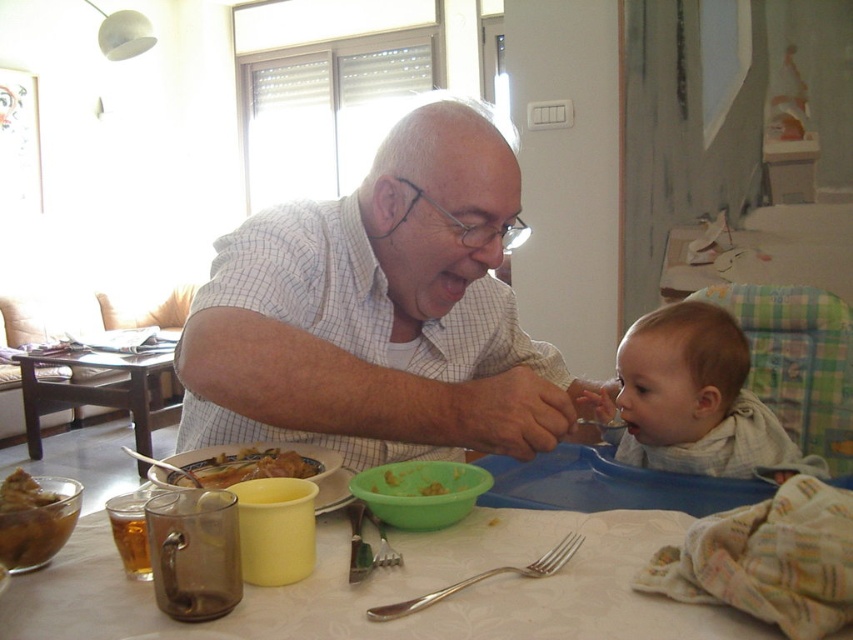
Is wooden table at center to the left of satin silver fork at table center from the viewer's perspective?

Indeed, wooden table at center is positioned on the left side of satin silver fork at table center.

Is wooden table at center to the right of satin silver fork at table center from the viewer's perspective?

In fact, wooden table at center is to the left of satin silver fork at table center.

Is point (22, 365) farther from camera compared to point (375, 609)?

Yes, it is behind point (375, 609).

What are the coordinates of `wooden table at center` in the screenshot? It's located at (97, 392).

From the picture: Is white textured tablecloth at center smaller than golden brown bread at center?

Incorrect, white textured tablecloth at center is not smaller in size than golden brown bread at center.

Who is positioned more to the right, white textured tablecloth at center or golden brown bread at center?

From the viewer's perspective, white textured tablecloth at center appears more on the right side.

Consider the image. Who is more distant from viewer, (607, 636) or (250, 458)?

Positioned behind is point (250, 458).

Locate an element on the screen. The width and height of the screenshot is (853, 640). white textured tablecloth at center is located at coordinates (396, 588).

Between white checkered shirt at center and light brown fabric baby at lower right, which one is positioned higher?

white checkered shirt at center is above.

Between white checkered shirt at center and light brown fabric baby at lower right, which one appears on the right side from the viewer's perspective?

From the viewer's perspective, light brown fabric baby at lower right appears more on the right side.

This screenshot has width=853, height=640. Describe the element at coordinates (379, 312) in the screenshot. I see `white checkered shirt at center` at that location.

This screenshot has height=640, width=853. What are the coordinates of `white checkered shirt at center` in the screenshot? It's located at (379, 312).